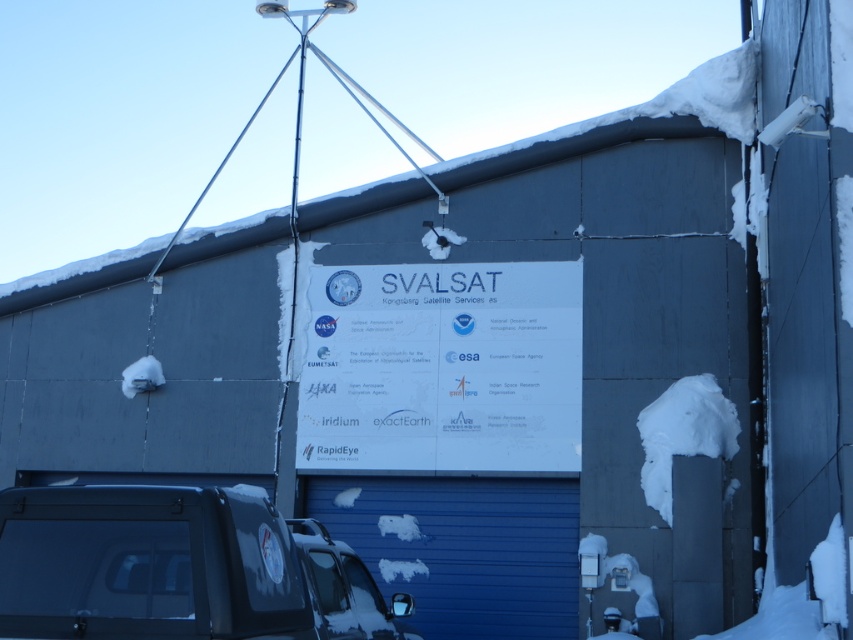
Question: Is white paper sign at center positioned before white fluffy snow at right?

Choices:
 (A) no
 (B) yes

Answer: (A)

Question: Is shiny black suv at lower left to the left of blue metallic garage door at lower center from the viewer's perspective?

Choices:
 (A) no
 (B) yes

Answer: (B)

Question: Which point is closer to the camera taking this photo?

Choices:
 (A) (403, 269)
 (B) (160, 516)
 (C) (538, 532)

Answer: (B)

Question: Estimate the real-world distances between objects in this image. Which object is farther from the white paper sign at center?

Choices:
 (A) shiny black suv at lower left
 (B) white fluffy snow at right

Answer: (A)

Question: Which point appears farthest from the camera in this image?

Choices:
 (A) (299, 625)
 (B) (648, 445)
 (C) (560, 506)

Answer: (C)

Question: Does white paper sign at center have a greater width compared to blue metallic garage door at lower center?

Choices:
 (A) yes
 (B) no

Answer: (A)